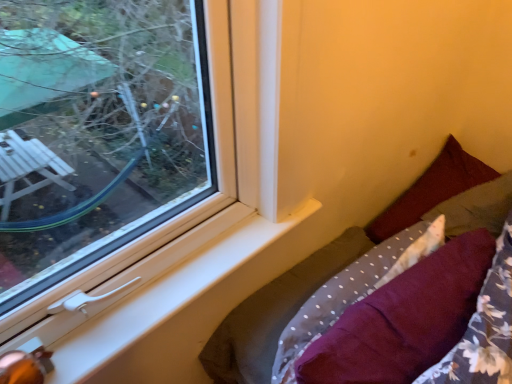
Measure the distance between point (362,366) and camera.

Point (362,366) and camera are 83.70 centimeters apart.

Image resolution: width=512 pixels, height=384 pixels. Find the location of `maroon fabric pillow at right, the second pillow viewed from the right`. maroon fabric pillow at right, the second pillow viewed from the right is located at coordinates (431, 190).

I want to click on white plastic window sill at lower left, so click(170, 312).

Consider the image. Which of these two, velvet burgundy pillow at lower right or maroon fabric pillow at right, the second pillow viewed from the right, is wider?

velvet burgundy pillow at lower right.

Relative to maroon fabric pillow at right, the second pillow viewed from the right, is velvet burgundy pillow at lower right in front or behind?

velvet burgundy pillow at lower right is in front of maroon fabric pillow at right, the second pillow viewed from the right.

Is velvet burgundy pillow at lower right positioned beyond the bounds of maroon fabric pillow at right, the 2th pillow when ordered from left to right?

Yes, velvet burgundy pillow at lower right is located beyond the bounds of maroon fabric pillow at right, the 2th pillow when ordered from left to right.

In terms of size, does velvet burgundy pillow at lower right appear bigger or smaller than maroon fabric pillow at right, the 2th pillow when ordered from left to right?

Clearly, velvet burgundy pillow at lower right is larger in size than maroon fabric pillow at right, the 2th pillow when ordered from left to right.

Considering the positions of point (405, 218) and point (270, 221), is point (405, 218) closer or farther from the camera than point (270, 221)?

Point (405, 218) is farther from the camera than point (270, 221).

From a real-world perspective, is maroon fabric pillow at right, the 2th pillow when ordered from left to right, located beneath white plastic window sill at lower left?

Yes, from a real-world perspective, maroon fabric pillow at right, the 2th pillow when ordered from left to right, is below white plastic window sill at lower left.

Consider the image. Is maroon fabric pillow at right, the second pillow viewed from the right, positioned before white plastic window sill at lower left?

No, the depth of maroon fabric pillow at right, the second pillow viewed from the right, is greater than that of white plastic window sill at lower left.

Which object is thinner, maroon fabric pillow at right, the second pillow viewed from the right, or white plastic window sill at lower left?

white plastic window sill at lower left.

Consider the image. In terms of width, does maroon fabric pillow at right, which appears as the 3th pillow when viewed from the left, look wider or thinner when compared to velvet burgundy pillow at lower right?

Clearly, maroon fabric pillow at right, which appears as the 3th pillow when viewed from the left, has less width compared to velvet burgundy pillow at lower right.

Is velvet burgundy pillow at lower right at the back of maroon fabric pillow at right, arranged as the first pillow when viewed from the right?

No, maroon fabric pillow at right, arranged as the first pillow when viewed from the right, is not facing the opposite direction of velvet burgundy pillow at lower right.

Is maroon fabric pillow at right, arranged as the first pillow when viewed from the right, smaller than velvet burgundy pillow at lower right?

Correct, maroon fabric pillow at right, arranged as the first pillow when viewed from the right, occupies less space than velvet burgundy pillow at lower right.

Which is less distant, (497, 190) or (228, 338)?

The point (228, 338) is closer to the camera.

Which is correct: maroon fabric pillow at lower right, placed as the first pillow when sorted from left to right, is inside maroon fabric pillow at right, the second pillow viewed from the right, or outside of it?

maroon fabric pillow at lower right, placed as the first pillow when sorted from left to right, cannot be found inside maroon fabric pillow at right, the second pillow viewed from the right.

Is maroon fabric pillow at lower right, the third pillow viewed from the right, not close to maroon fabric pillow at right, the second pillow viewed from the right?

No, maroon fabric pillow at lower right, the third pillow viewed from the right, is not far away from maroon fabric pillow at right, the second pillow viewed from the right.

Considering the positions of objects maroon fabric pillow at lower right, placed as the first pillow when sorted from left to right, and maroon fabric pillow at right, the 2th pillow when ordered from left to right, in the image provided, who is more to the right, maroon fabric pillow at lower right, placed as the first pillow when sorted from left to right, or maroon fabric pillow at right, the 2th pillow when ordered from left to right,?

Result: From the viewer's perspective, maroon fabric pillow at right, the 2th pillow when ordered from left to right, appears more on the right side.

Could you measure the distance between maroon fabric pillow at right, the 2th pillow when ordered from left to right, and maroon fabric pillow at lower right, the third pillow viewed from the right?

maroon fabric pillow at right, the 2th pillow when ordered from left to right, is 41.82 centimeters away from maroon fabric pillow at lower right, the third pillow viewed from the right.

Who is bigger, maroon fabric pillow at right, the 2th pillow when ordered from left to right, or maroon fabric pillow at lower right, placed as the first pillow when sorted from left to right?

maroon fabric pillow at lower right, placed as the first pillow when sorted from left to right, is bigger.

Based on the photo, are maroon fabric pillow at right, the 2th pillow when ordered from left to right, and maroon fabric pillow at lower right, the third pillow viewed from the right, located far from each other?

They are positioned close to each other.

Do you think maroon fabric pillow at right, the second pillow viewed from the right, is within maroon fabric pillow at lower right, the third pillow viewed from the right, or outside of it?

maroon fabric pillow at right, the second pillow viewed from the right, is spatially situated outside maroon fabric pillow at lower right, the third pillow viewed from the right.

Is maroon fabric pillow at lower right, the third pillow viewed from the right, shorter than velvet burgundy pillow at lower right?

Indeed, maroon fabric pillow at lower right, the third pillow viewed from the right, has a lesser height compared to velvet burgundy pillow at lower right.

From the image's perspective, is maroon fabric pillow at lower right, the third pillow viewed from the right, located above or below velvet burgundy pillow at lower right?

maroon fabric pillow at lower right, the third pillow viewed from the right, is situated higher than velvet burgundy pillow at lower right in the image.

In the scene shown: Between maroon fabric pillow at lower right, placed as the first pillow when sorted from left to right, and velvet burgundy pillow at lower right, which one has smaller width?

maroon fabric pillow at lower right, placed as the first pillow when sorted from left to right, is thinner.

Would you consider maroon fabric pillow at lower right, the third pillow viewed from the right, to be distant from velvet burgundy pillow at lower right?

That's not correct — maroon fabric pillow at lower right, the third pillow viewed from the right, is a little close to velvet burgundy pillow at lower right.

In the image, is white plastic window sill at lower left positioned in front of or behind velvet burgundy pillow at lower right?

white plastic window sill at lower left is positioned closer to the viewer than velvet burgundy pillow at lower right.

The height and width of the screenshot is (384, 512). In order to click on bed that appears behind the white plastic window sill at lower left in this screenshot , I will do `click(328, 271)`.

In the scene shown: Which is more to the right, white plastic window sill at lower left or velvet burgundy pillow at lower right?

From the viewer's perspective, velvet burgundy pillow at lower right appears more on the right side.

Is white plastic window sill at lower left wider than velvet burgundy pillow at lower right?

In fact, white plastic window sill at lower left might be narrower than velvet burgundy pillow at lower right.

At what (x,y) coordinates should I click in order to perform the action: click on pillow that is the 3rd object above the velvet burgundy pillow at lower right (from a real-world perspective). Please return your answer as a coordinate pair (x, y). Looking at the image, I should click on (431, 190).

I want to click on window sill located below the maroon fabric pillow at right, the 2th pillow when ordered from left to right (from the image's perspective), so click(170, 312).

Which object lies further to the anchor point maroon fabric pillow at lower right, placed as the first pillow when sorted from left to right, maroon fabric pillow at right, the second pillow viewed from the right, or maroon fabric pillow at right, which appears as the 3th pillow when viewed from the left?

The object further to maroon fabric pillow at lower right, placed as the first pillow when sorted from left to right, is maroon fabric pillow at right, the second pillow viewed from the right.

From the picture: Based on their spatial positions, is white plastic window sill at lower left or maroon fabric pillow at right, which appears as the 3th pillow when viewed from the left, further from velvet burgundy pillow at lower right?

The object further to velvet burgundy pillow at lower right is white plastic window sill at lower left.

When comparing their distances from white plastic window sill at lower left, does maroon fabric pillow at right, which appears as the 3th pillow when viewed from the left, or maroon fabric pillow at lower right, the third pillow viewed from the right, seem further?

maroon fabric pillow at right, which appears as the 3th pillow when viewed from the left, is positioned further to the anchor white plastic window sill at lower left.

Which object lies further to the anchor point maroon fabric pillow at lower right, the third pillow viewed from the right, maroon fabric pillow at right, the second pillow viewed from the right, or white plastic window sill at lower left?

maroon fabric pillow at right, the second pillow viewed from the right, lies further to maroon fabric pillow at lower right, the third pillow viewed from the right, than the other object.

Looking at the image, which one is located further to velvet burgundy pillow at lower right, maroon fabric pillow at lower right, the third pillow viewed from the right, or maroon fabric pillow at right, the 2th pillow when ordered from left to right?

maroon fabric pillow at lower right, the third pillow viewed from the right, lies further to velvet burgundy pillow at lower right than the other object.

Estimate the real-world distances between objects in this image. Which object is closer to white plastic window sill at lower left, maroon fabric pillow at right, arranged as the first pillow when viewed from the right, or velvet burgundy pillow at lower right?

Based on the image, velvet burgundy pillow at lower right appears to be nearer to white plastic window sill at lower left.

Estimate the real-world distances between objects in this image. Which object is further from maroon fabric pillow at lower right, placed as the first pillow when sorted from left to right, maroon fabric pillow at right, arranged as the first pillow when viewed from the right, or maroon fabric pillow at right, the 2th pillow when ordered from left to right?

maroon fabric pillow at right, the 2th pillow when ordered from left to right, is positioned further to the anchor maroon fabric pillow at lower right, placed as the first pillow when sorted from left to right.

Which object lies nearer to the anchor point velvet burgundy pillow at lower right, maroon fabric pillow at right, which appears as the 3th pillow when viewed from the left, or white plastic window sill at lower left?

The object closer to velvet burgundy pillow at lower right is maroon fabric pillow at right, which appears as the 3th pillow when viewed from the left.

Find the location of a particular element. This screenshot has height=384, width=512. bed situated between white plastic window sill at lower left and maroon fabric pillow at right, the second pillow viewed from the right, from left to right is located at coordinates (328, 271).

Where is `pillow between white plastic window sill at lower left and maroon fabric pillow at right, the second pillow viewed from the right`? The width and height of the screenshot is (512, 384). pillow between white plastic window sill at lower left and maroon fabric pillow at right, the second pillow viewed from the right is located at coordinates (404, 319).

What are the coordinates of `bed located between maroon fabric pillow at lower right, placed as the first pillow when sorted from left to right, and maroon fabric pillow at right, the second pillow viewed from the right, in the depth direction` in the screenshot? It's located at (328, 271).

I want to click on bed situated between white plastic window sill at lower left and maroon fabric pillow at right, which appears as the 3th pillow when viewed from the left, from left to right, so click(x=328, y=271).